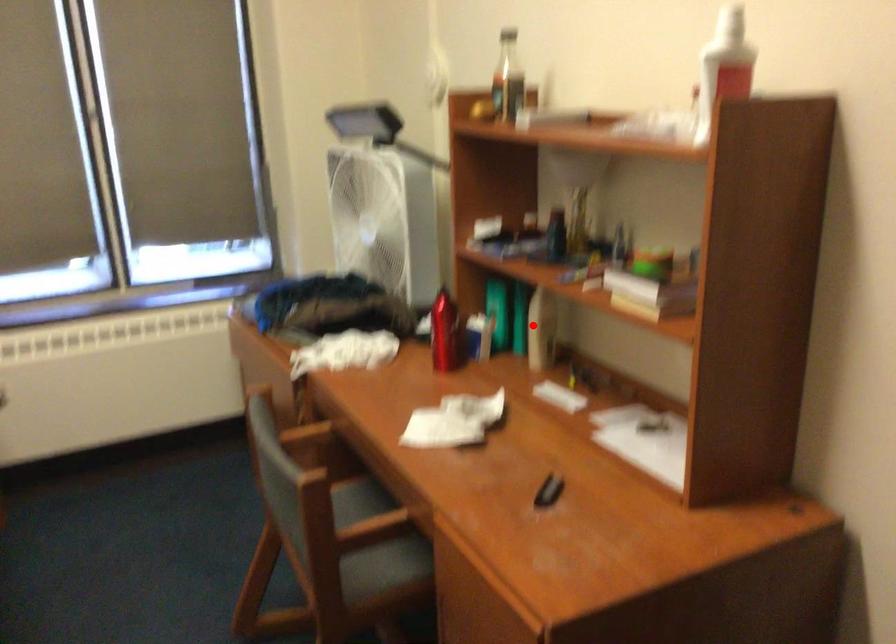
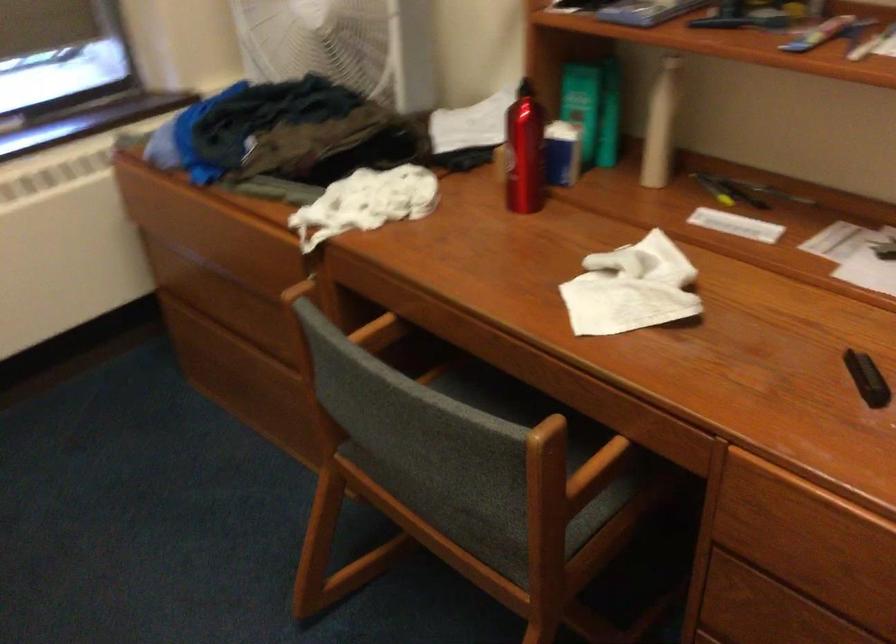
Question: I am providing you with two images of the same scene from different viewpoints. In image1, a red point is highlighted. Considering the same 3D point in image2, which of the following is correct?

Choices:
 (A) It is closer
 (B) It is farther

Answer: (A)